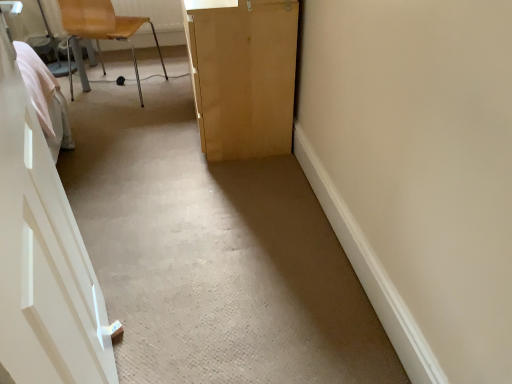
The image size is (512, 384). What do you see at coordinates (101, 29) in the screenshot?
I see `light brown wood chair at upper left` at bounding box center [101, 29].

What is the approximate width of light brown wood chair at upper left?

The width of light brown wood chair at upper left is 61.52 centimeters.

Identify the location of light brown wood chair at upper left. (101, 29).

Identify the location of light brown wood chair at upper left. (101, 29).